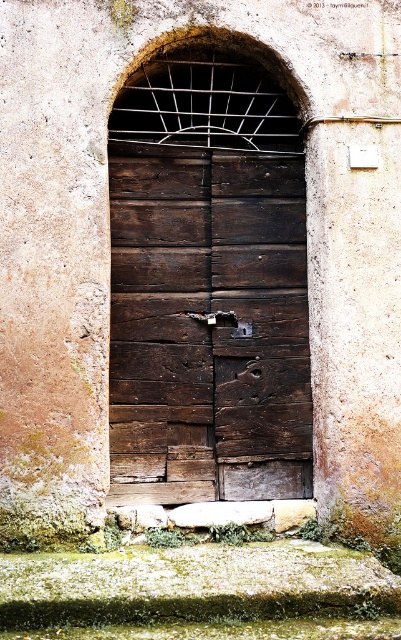
You are a delivery person trying to deliver a package to the dark wood door at center. However, there is a metallic dark brown lock at center blocking the entrance. Can you estimate if the lock is bigger than the door?

The dark wood door at center is larger in size than metallic dark brown lock at center, so the lock is smaller than the door.

You are a delivery person trying to access the building through the dark wood door at center. You notice the metallic dark brown lock at center. Which object would you interact with first to gain entry?

You would first interact with the metallic dark brown lock at center because it is further away than the dark wood door at center, so you need to reach it to unlock the door.

You are a drone operator trying to capture a photo of the weathered wooden door. You notice two points marked on the door. The first point is at coordinate point (283, 419) and the second is at point (247, 326). Which of these points will appear larger in the photo due to perspective?

Point (283, 419) will appear larger in the photo because it is closer to the camera than point (247, 326).